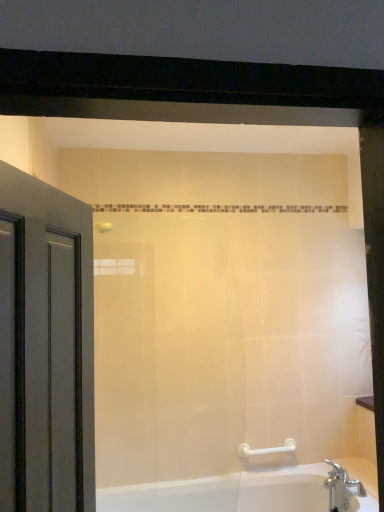
Question: Is white glossy bathtub at lower right to the right of chrome metallic faucet at lower right from the viewer's perspective?

Choices:
 (A) yes
 (B) no

Answer: (B)

Question: From the image's perspective, is white glossy bathtub at lower right under chrome metallic faucet at lower right?

Choices:
 (A) yes
 (B) no

Answer: (A)

Question: Can you confirm if white glossy bathtub at lower right is taller than chrome metallic faucet at lower right?

Choices:
 (A) no
 (B) yes

Answer: (B)

Question: Is white glossy bathtub at lower right positioned with its back to chrome metallic faucet at lower right?

Choices:
 (A) no
 (B) yes

Answer: (A)

Question: Is white glossy bathtub at lower right to the left of chrome metallic faucet at lower right from the viewer's perspective?

Choices:
 (A) no
 (B) yes

Answer: (B)

Question: In terms of size, does matte gray door at left appear bigger or smaller than white glossy bathtub at lower right?

Choices:
 (A) big
 (B) small

Answer: (B)

Question: Would you say matte gray door at left is to the left or to the right of white glossy bathtub at lower right in the picture?

Choices:
 (A) left
 (B) right

Answer: (A)

Question: From the image's perspective, relative to white glossy bathtub at lower right, is matte gray door at left above or below?

Choices:
 (A) below
 (B) above

Answer: (B)

Question: In terms of height, does matte gray door at left look taller or shorter compared to white glossy bathtub at lower right?

Choices:
 (A) tall
 (B) short

Answer: (A)

Question: From a real-world perspective, is matte gray door at left above or below chrome metallic faucet at lower right?

Choices:
 (A) above
 (B) below

Answer: (A)

Question: Is point (8, 486) positioned closer to the camera than point (337, 507)?

Choices:
 (A) closer
 (B) farther

Answer: (A)

Question: Considering the positions of matte gray door at left and chrome metallic faucet at lower right in the image, is matte gray door at left taller or shorter than chrome metallic faucet at lower right?

Choices:
 (A) tall
 (B) short

Answer: (A)

Question: From the image's perspective, relative to chrome metallic faucet at lower right, is matte gray door at left above or below?

Choices:
 (A) above
 (B) below

Answer: (A)

Question: Is point (248, 449) closer or farther from the camera than point (345, 501)?

Choices:
 (A) farther
 (B) closer

Answer: (A)

Question: From the image's perspective, relative to chrome metallic faucet at lower right, is white plastic grab bar at lower right above or below?

Choices:
 (A) below
 (B) above

Answer: (B)